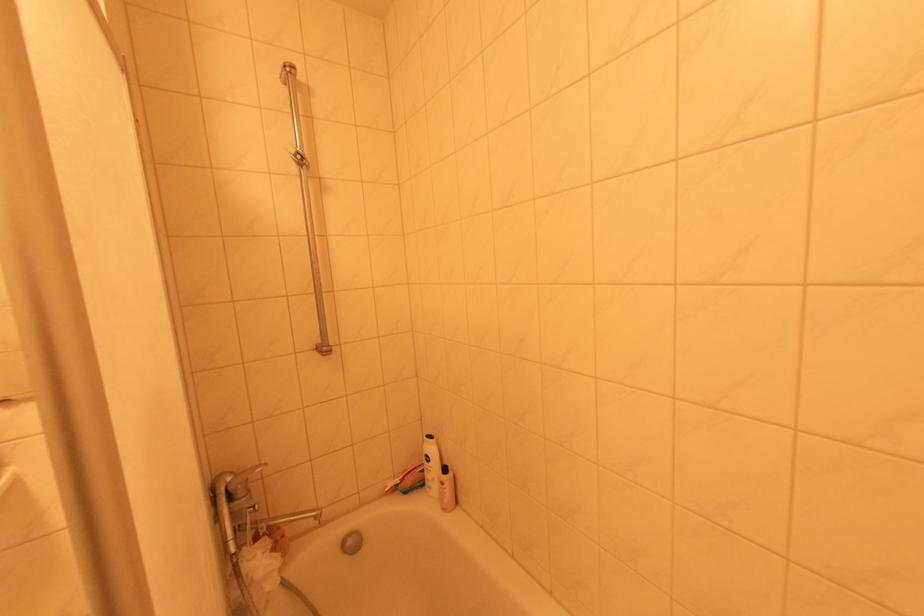
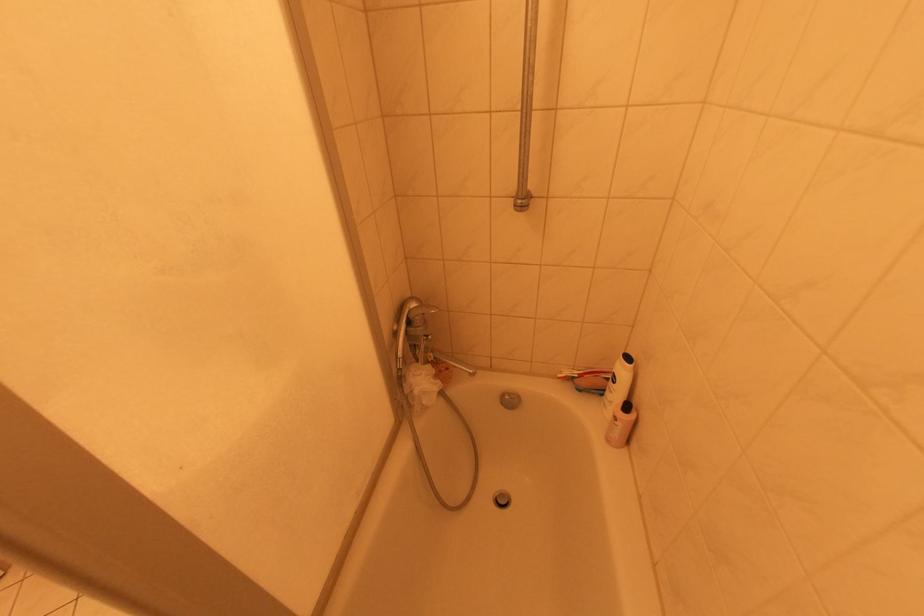
Based on the continuous images, in which direction is the camera rotating?

The camera rotated toward left-down.